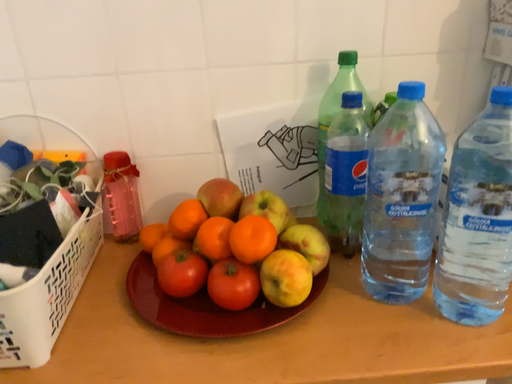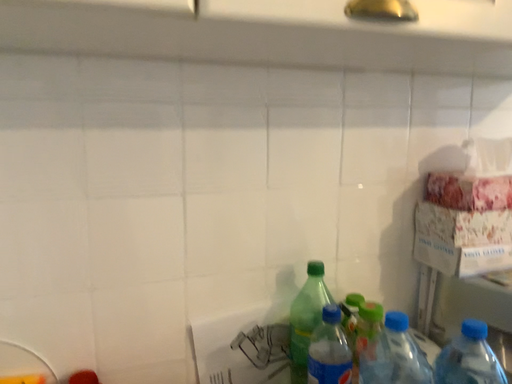
Question: How did the camera likely rotate when shooting the video?

Choices:
 (A) rotated downward
 (B) rotated upward

Answer: (B)